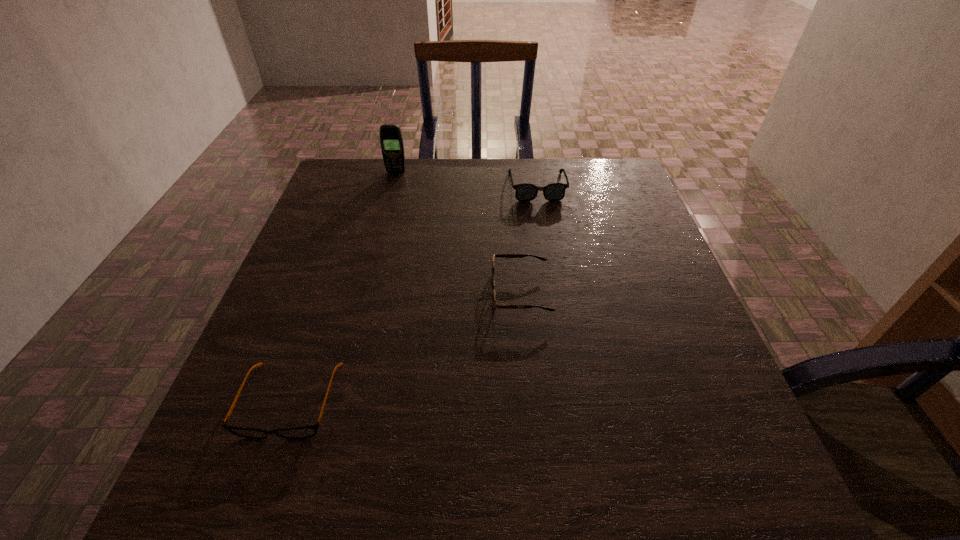
What are the coordinates of `cellular telephone` in the screenshot? It's located at (391, 140).

This screenshot has height=540, width=960. In order to click on the farthest spectacles in this screenshot , I will do `click(555, 191)`.

What are the coordinates of `the second nearest spectacles` in the screenshot? It's located at (494, 303).

Locate an element on the screen. the shortest spectacles is located at coordinates (309, 431).

Where is `the nearest object`? This screenshot has width=960, height=540. the nearest object is located at coordinates (309, 431).

At what (x,y) coordinates should I click in order to perform the action: click on vacant space located 0.320m on the screen of the cellular telephone. Please return your answer as a coordinate pair (x, y). This screenshot has height=540, width=960. Looking at the image, I should click on (378, 242).

This screenshot has width=960, height=540. I want to click on free location located on the face of the farthest spectacles, so pyautogui.click(x=550, y=266).

Locate an element on the screen. This screenshot has height=540, width=960. free region located on the frame of the third farthest object is located at coordinates (459, 293).

You are a GUI agent. You are given a task and a screenshot of the screen. Output one action in this format:
    pyautogui.click(x=<x>, y=<y>)
    Task: Click on the free space located 0.130m on the frame of the third farthest object
    This screenshot has width=960, height=540.
    Given the screenshot: What is the action you would take?
    pyautogui.click(x=432, y=293)

Where is `vacant space situated on the frame of the third farthest object`? vacant space situated on the frame of the third farthest object is located at coordinates (313, 293).